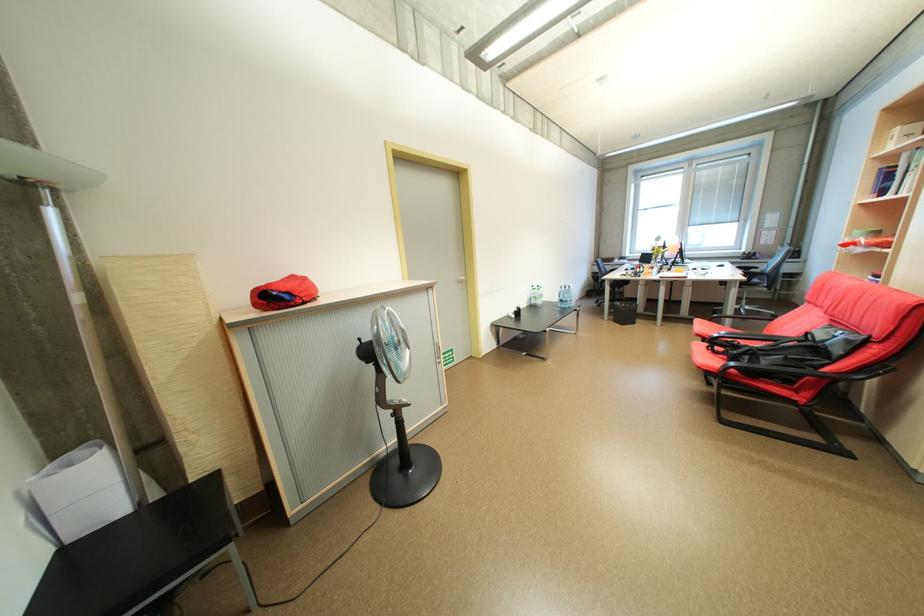
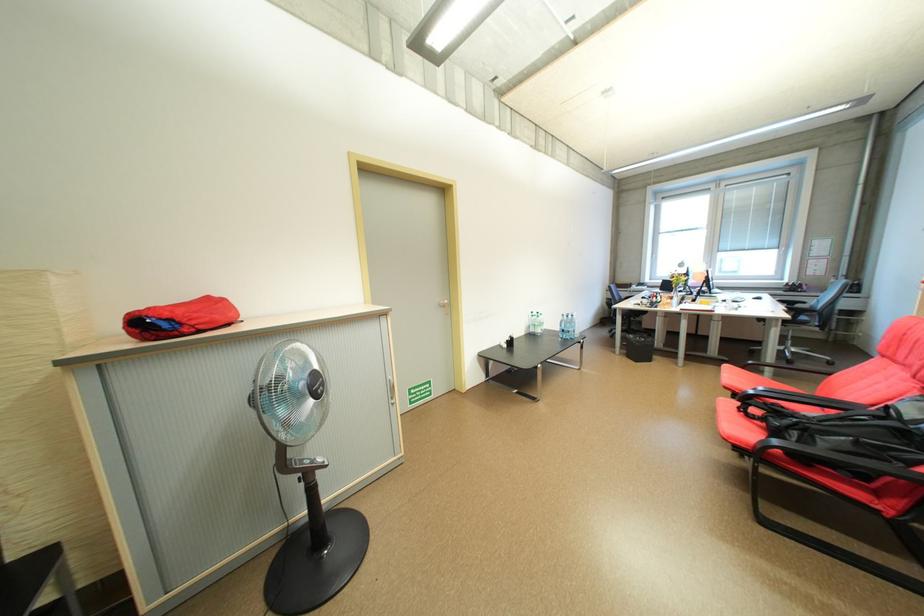
The images are taken continuously from a first-person perspective. In which direction are you moving?

The movement direction of the cameraman is right, forward.